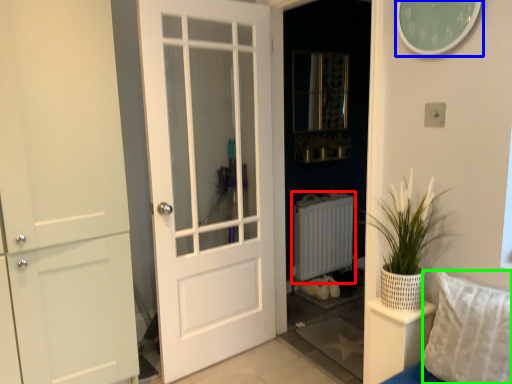
Question: Based on their relative distances, which object is farther from radiator (highlighted by a red box)? Choose from clock (highlighted by a blue box) and pillow (highlighted by a green box).

Choices:
 (A) clock
 (B) pillow

Answer: (A)